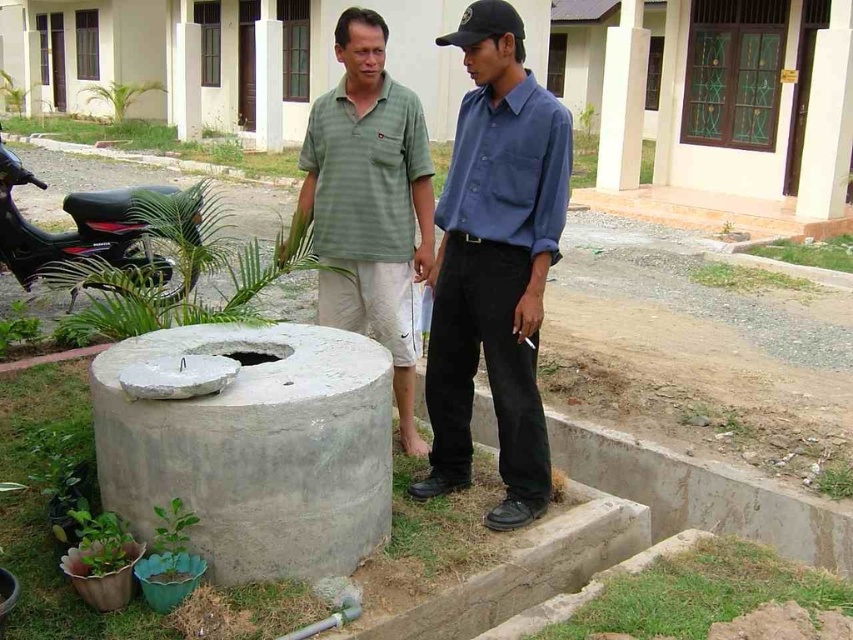
From the picture: You are standing in front of the well and want to place a small flag at the point closer to you. Which point should you choose between point (x=346, y=410) and point (x=39, y=180)?

You should choose point (x=346, y=410) because it is closer to the camera than point (x=39, y=180).

You are standing in the residential area near the well. You see the gray concrete at lower left and the green striped polo shirt at center. Which object is positioned more to the left?

The gray concrete at lower left is positioned more to the left than the green striped polo shirt at center.

From the picture: You are a painter who needs to paint the gray concrete at lower left and the blue cotton shirt at center. Which object requires a taller ladder to reach its top?

The blue cotton shirt at center requires a taller ladder because it is taller than the gray concrete at lower left.